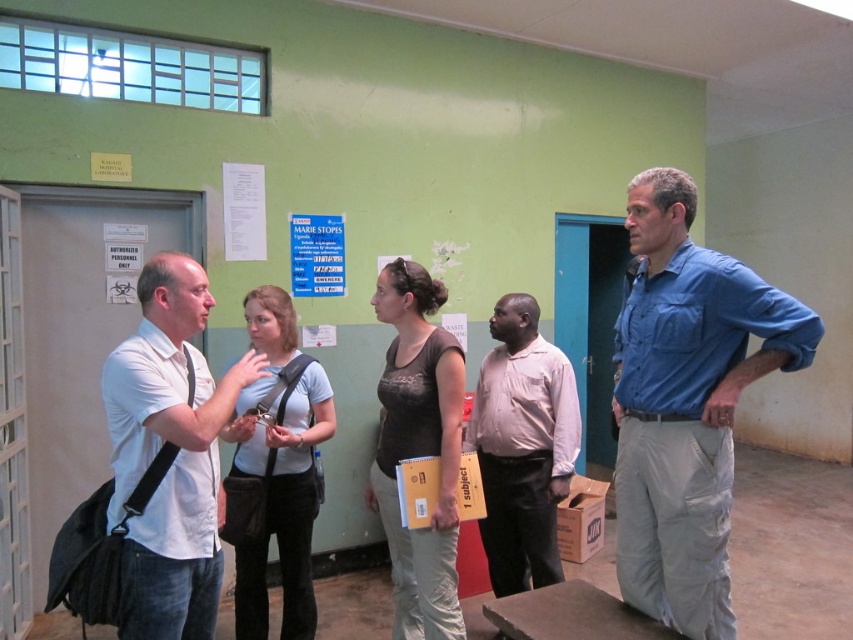
Is white matte shirt at left thinner than light brown shirt at center?

Yes, white matte shirt at left is thinner than light brown shirt at center.

From the picture: Is white matte shirt at left positioned before light brown shirt at center?

Yes, it is in front of light brown shirt at center.

Image resolution: width=853 pixels, height=640 pixels. In order to click on white matte shirt at left in this screenshot , I will do `click(175, 460)`.

Consider the image. Which is below, blue cotton shirt at center or white matte shirt at left?

white matte shirt at left is below.

Between point (660, 614) and point (152, 456), which one is positioned in front?

Point (152, 456) is in front.

Measure the distance between blue cotton shirt at center and camera.

6.16 feet

Where is `blue cotton shirt at center`? blue cotton shirt at center is located at coordinates (686, 403).

Between blue cotton shirt at center and light brown shirt at center, which one appears on the left side from the viewer's perspective?

light brown shirt at center

Locate an element on the screen. The height and width of the screenshot is (640, 853). blue cotton shirt at center is located at coordinates (686, 403).

At what (x,y) coordinates should I click in order to perform the action: click on blue cotton shirt at center. Please return your answer as a coordinate pair (x, y). This screenshot has height=640, width=853. Looking at the image, I should click on (686, 403).